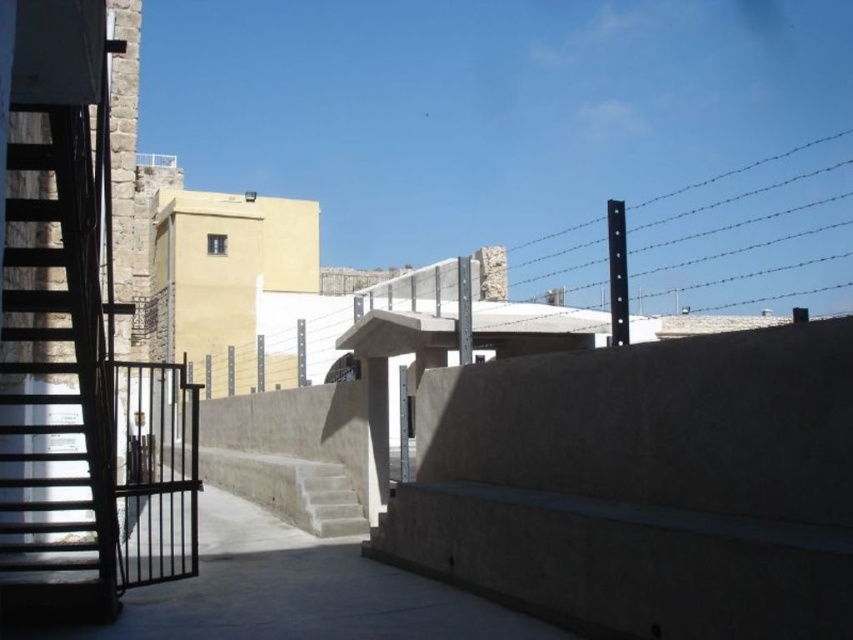
Does smooth concrete stairs at center have a larger size compared to concrete stairs at center?

Yes, smooth concrete stairs at center is bigger than concrete stairs at center.

Can you confirm if smooth concrete stairs at center is positioned above concrete stairs at center?

Incorrect, smooth concrete stairs at center is not positioned above concrete stairs at center.

Between point (235, 467) and point (315, 481), which one is positioned behind?

Positioned behind is point (235, 467).

Where is `smooth concrete stairs at center`? smooth concrete stairs at center is located at coordinates (288, 488).